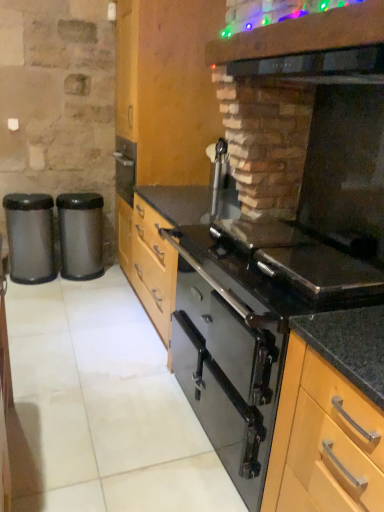
What is the approximate height of metallic trash can at left, marked as the second waste container in a right-to-left arrangement?

It is 27.29 inches.

Where is `black glass oven at center`? This screenshot has width=384, height=512. black glass oven at center is located at coordinates (282, 382).

Find the location of `metallic trash can at left, which ranks as the 1th waste container in left-to-right order`. metallic trash can at left, which ranks as the 1th waste container in left-to-right order is located at coordinates (30, 237).

Based on the photo, could wooden cabinet at center, the 2th cabinetry when ordered from bottom to top, be considered to be inside satin black trash can at left, arranged as the 2th waste container when viewed from the left?

That's incorrect, wooden cabinet at center, the 2th cabinetry when ordered from bottom to top, is not inside satin black trash can at left, arranged as the 2th waste container when viewed from the left.

In the scene shown: From the image's perspective, is satin black trash can at left, the first waste container from the right, below wooden cabinet at center, the 1th cabinetry when ordered from left to right?

Indeed, from the image's perspective, satin black trash can at left, the first waste container from the right, is shown beneath wooden cabinet at center, the 1th cabinetry when ordered from left to right.

Considering the relative positions of satin black trash can at left, arranged as the 2th waste container when viewed from the left, and wooden cabinet at center, arranged as the 1th cabinetry when viewed from the top, in the image provided, is satin black trash can at left, arranged as the 2th waste container when viewed from the left, to the right of wooden cabinet at center, arranged as the 1th cabinetry when viewed from the top, from the viewer's perspective?

In fact, satin black trash can at left, arranged as the 2th waste container when viewed from the left, is to the left of wooden cabinet at center, arranged as the 1th cabinetry when viewed from the top.

Does point (349, 64) appear closer or farther from the camera than point (49, 219)?

Clearly, point (349, 64) is closer to the camera than point (49, 219).

Is black glass exhaust hood at upper right oriented away from metallic trash can at left, marked as the second waste container in a right-to-left arrangement?

black glass exhaust hood at upper right does not have its back to metallic trash can at left, marked as the second waste container in a right-to-left arrangement.

Is black glass exhaust hood at upper right smaller than metallic trash can at left, which ranks as the 1th waste container in left-to-right order?

Yes, black glass exhaust hood at upper right is smaller than metallic trash can at left, which ranks as the 1th waste container in left-to-right order.

In the image, is black glass exhaust hood at upper right on the left side or the right side of metallic trash can at left, marked as the second waste container in a right-to-left arrangement?

Clearly, black glass exhaust hood at upper right is on the right of metallic trash can at left, marked as the second waste container in a right-to-left arrangement, in the image.

Considering the sizes of objects black glass exhaust hood at upper right and wooden cabinet at center, which is the first cabinetry in back-to-front order, in the image provided, who is taller, black glass exhaust hood at upper right or wooden cabinet at center, which is the first cabinetry in back-to-front order,?

wooden cabinet at center, which is the first cabinetry in back-to-front order, is taller.

Which is behind, point (314, 55) or point (149, 1)?

Point (149, 1)

Between black glass exhaust hood at upper right and wooden cabinet at center, the 2th cabinetry when ordered from bottom to top, which one has smaller width?

black glass exhaust hood at upper right is thinner.

Consider the image. Is black glass exhaust hood at upper right bigger or smaller than wooden cabinet at center, which is the first cabinetry in back-to-front order?

Considering their sizes, black glass exhaust hood at upper right takes up less space than wooden cabinet at center, which is the first cabinetry in back-to-front order.

Consider the image. From the image's perspective, is metallic trash can at left, which ranks as the 1th waste container in left-to-right order, below black glass oven at center?

No, from the image's perspective, metallic trash can at left, which ranks as the 1th waste container in left-to-right order, is not beneath black glass oven at center.

Does point (9, 248) come farther from viewer compared to point (309, 478)?

Yes, point (9, 248) is farther from viewer.

From their relative heights in the image, would you say metallic trash can at left, marked as the second waste container in a right-to-left arrangement, is taller or shorter than black glass oven at center?

Clearly, metallic trash can at left, marked as the second waste container in a right-to-left arrangement, is shorter compared to black glass oven at center.

Between light wood cabinet at center, arranged as the 2th cabinetry when viewed from the left, and metallic trash can at left, which ranks as the 1th waste container in left-to-right order, which one has smaller width?

metallic trash can at left, which ranks as the 1th waste container in left-to-right order.

Is light wood cabinet at center, which appears as the 1th cabinetry when ordered from the bottom, aimed at metallic trash can at left, which ranks as the 1th waste container in left-to-right order?

No, light wood cabinet at center, which appears as the 1th cabinetry when ordered from the bottom, is not turned towards metallic trash can at left, which ranks as the 1th waste container in left-to-right order.

What's the angular difference between light wood cabinet at center, arranged as the 2th cabinetry when viewed from the left, and metallic trash can at left, which ranks as the 1th waste container in left-to-right order,'s facing directions?

89.6 degrees.

Is metallic trash can at left, which ranks as the 1th waste container in left-to-right order, surrounded by light wood cabinet at center, arranged as the 2th cabinetry when viewed from the left?

No.

Is point (13, 212) farther from viewer compared to point (70, 226)?

No, it is not.

Is metallic trash can at left, marked as the second waste container in a right-to-left arrangement, in front of satin black trash can at left, the first waste container from the right?

Yes, metallic trash can at left, marked as the second waste container in a right-to-left arrangement, is closer to the camera.

From the image's perspective, which object appears higher, metallic trash can at left, which ranks as the 1th waste container in left-to-right order, or satin black trash can at left, arranged as the 2th waste container when viewed from the left?

satin black trash can at left, arranged as the 2th waste container when viewed from the left, from the image's perspective.

Would you say satin black trash can at left, the first waste container from the right, is part of metallic trash can at left, which ranks as the 1th waste container in left-to-right order,'s contents?

Definitely not — satin black trash can at left, the first waste container from the right, is not inside metallic trash can at left, which ranks as the 1th waste container in left-to-right order.

Where is `oven on the left of the light wood cabinet at center, which is the second cabinetry from back to front`? This screenshot has height=512, width=384. oven on the left of the light wood cabinet at center, which is the second cabinetry from back to front is located at coordinates (282, 382).

Considering the relative sizes of black glass oven at center and light wood cabinet at center, arranged as the 1th cabinetry when viewed from the right, in the image provided, is black glass oven at center smaller than light wood cabinet at center, arranged as the 1th cabinetry when viewed from the right,?

No, black glass oven at center is not smaller than light wood cabinet at center, arranged as the 1th cabinetry when viewed from the right.

Which is behind, point (312, 408) or point (309, 441)?

The point (309, 441) is farther from the camera.

From the image's perspective, which is above, black glass oven at center or light wood cabinet at center, arranged as the 1th cabinetry when viewed from the right?

black glass oven at center is shown above in the image.

This screenshot has width=384, height=512. There is a wooden cabinet at center, the 2th cabinetry from the right. Find the location of `the 1st waste container below it (from a real-world perspective)`. the 1st waste container below it (from a real-world perspective) is located at coordinates (81, 234).

Where is `exhaust hood that is above the metallic trash can at left, marked as the second waste container in a right-to-left arrangement (from the image's perspective)`? exhaust hood that is above the metallic trash can at left, marked as the second waste container in a right-to-left arrangement (from the image's perspective) is located at coordinates (314, 64).

Which object lies nearer to the anchor point light wood cabinet at center, which is the second cabinetry from back to front, metallic trash can at left, which ranks as the 1th waste container in left-to-right order, or wooden cabinet at center, which is the first cabinetry in back-to-front order?

Among the two, wooden cabinet at center, which is the first cabinetry in back-to-front order, is located nearer to light wood cabinet at center, which is the second cabinetry from back to front.

Looking at the image, which one is located closer to light wood cabinet at center, which is the second cabinetry from back to front, black glass oven at center or metallic trash can at left, marked as the second waste container in a right-to-left arrangement?

black glass oven at center.

Which object lies further to the anchor point wooden cabinet at center, the 2th cabinetry from the front, black glass oven at center or satin black trash can at left, the first waste container from the right?

The object further to wooden cabinet at center, the 2th cabinetry from the front, is black glass oven at center.

Based on their spatial positions, is metallic trash can at left, which ranks as the 1th waste container in left-to-right order, or satin black trash can at left, arranged as the 2th waste container when viewed from the left, closer to light wood cabinet at center, marked as the 1th cabinetry in a front-to-back arrangement?

Among the two, satin black trash can at left, arranged as the 2th waste container when viewed from the left, is located nearer to light wood cabinet at center, marked as the 1th cabinetry in a front-to-back arrangement.

Which object lies nearer to the anchor point black glossy vent at upper center, black glass exhaust hood at upper right or metallic trash can at left, which ranks as the 1th waste container in left-to-right order?

black glass exhaust hood at upper right.

Based on their spatial positions, is black glossy vent at upper center or satin black trash can at left, arranged as the 2th waste container when viewed from the left, further from wooden cabinet at center, the 2th cabinetry when ordered from bottom to top?

The object further to wooden cabinet at center, the 2th cabinetry when ordered from bottom to top, is black glossy vent at upper center.

Considering their positions, is black glass oven at center positioned further to wooden cabinet at center, the 1th cabinetry when ordered from left to right, than light wood cabinet at center, which appears as the 1th cabinetry when ordered from the bottom?

light wood cabinet at center, which appears as the 1th cabinetry when ordered from the bottom, is positioned further to the anchor wooden cabinet at center, the 1th cabinetry when ordered from left to right.

Looking at this image, when comparing their distances from black glass exhaust hood at upper right, does black glossy vent at upper center or satin black trash can at left, the first waste container from the right, seem further?

satin black trash can at left, the first waste container from the right.

Where is `cabinetry between black glossy vent at upper center and metallic trash can at left, which ranks as the 1th waste container in left-to-right order, along the z-axis`? cabinetry between black glossy vent at upper center and metallic trash can at left, which ranks as the 1th waste container in left-to-right order, along the z-axis is located at coordinates (161, 123).

Locate an element on the screen. cabinetry between black glass oven at center and satin black trash can at left, the first waste container from the right, from front to back is located at coordinates (161, 123).

Where is `waste container between black glossy vent at upper center and satin black trash can at left, arranged as the 2th waste container when viewed from the left, in the front-back direction`? Image resolution: width=384 pixels, height=512 pixels. waste container between black glossy vent at upper center and satin black trash can at left, arranged as the 2th waste container when viewed from the left, in the front-back direction is located at coordinates (30, 237).

Image resolution: width=384 pixels, height=512 pixels. I want to click on oven between black glass exhaust hood at upper right and wooden cabinet at center, the 2th cabinetry from the right, in the front-back direction, so click(x=282, y=382).